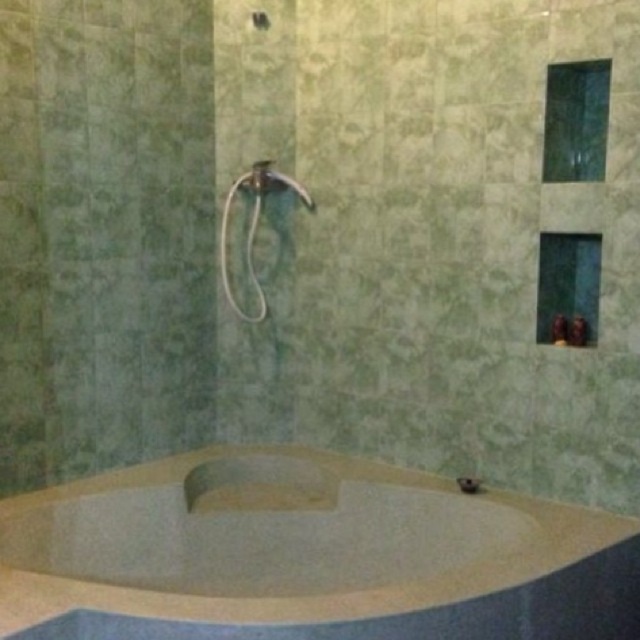
Question: Which is nearer to the matte white showerhead at upper center?

Choices:
 (A) beige stone jacuzzi at lower center
 (B) matte white showerhead at center

Answer: (B)

Question: Is beige stone jacuzzi at lower center to the left of matte white showerhead at upper center from the viewer's perspective?

Choices:
 (A) yes
 (B) no

Answer: (B)

Question: Can you confirm if beige stone jacuzzi at lower center is bigger than matte white showerhead at center?

Choices:
 (A) no
 (B) yes

Answer: (B)

Question: Based on their relative distances, which object is farther from the beige stone jacuzzi at lower center?

Choices:
 (A) matte white showerhead at center
 (B) matte white showerhead at upper center

Answer: (B)

Question: Does beige stone jacuzzi at lower center have a greater width compared to matte white showerhead at center?

Choices:
 (A) yes
 (B) no

Answer: (A)

Question: Among these objects, which one is farthest from the camera?

Choices:
 (A) matte white showerhead at upper center
 (B) beige stone jacuzzi at lower center

Answer: (A)